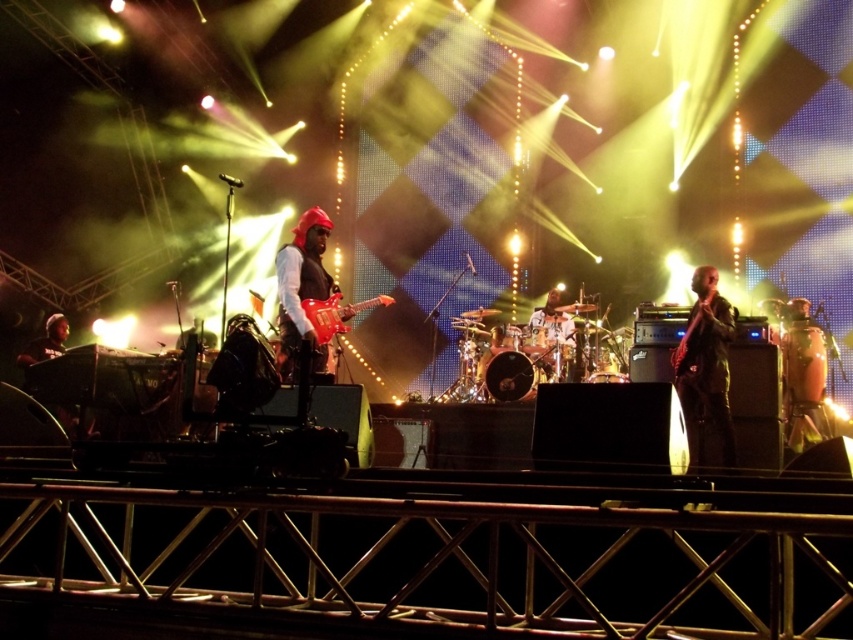
Question: Is glossy electric guitar at center thinner than matte black headphones at left?

Choices:
 (A) no
 (B) yes

Answer: (A)

Question: Is wooden drum at right to the right of shiny silver drum set at center from the viewer's perspective?

Choices:
 (A) no
 (B) yes

Answer: (B)

Question: Which point is farther to the camera?

Choices:
 (A) (556, 376)
 (B) (689, 426)
 (C) (45, 333)
 (D) (796, 451)

Answer: (C)

Question: In this image, where is matte black guitar at center located relative to wooden drum at right?

Choices:
 (A) right
 (B) left

Answer: (B)

Question: Which object is farther from the camera taking this photo?

Choices:
 (A) matte black headphones at left
 (B) matte black guitar at center

Answer: (A)

Question: Which point is closer to the camera?

Choices:
 (A) (815, 372)
 (B) (341, 312)

Answer: (B)